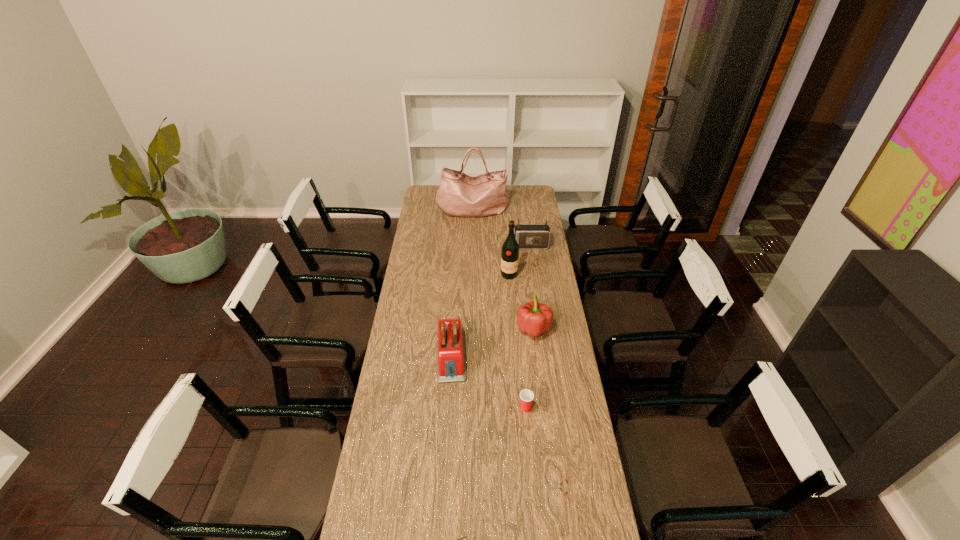
Locate an element on the screen. Image resolution: width=960 pixels, height=540 pixels. object that is at the far edge is located at coordinates (460, 195).

You are a GUI agent. You are given a task and a screenshot of the screen. Output one action in this format:
    pyautogui.click(x=<x>, y=<y>)
    Task: Click on the object located at the left edge
    This screenshot has height=540, width=960.
    Given the screenshot: What is the action you would take?
    pyautogui.click(x=460, y=195)

Identify the location of camcorder positioned at the right edge. The image size is (960, 540). (528, 236).

In order to click on bell pepper located at the right edge in this screenshot , I will do `click(534, 318)`.

Locate an element on the screen. The image size is (960, 540). shears present at the right edge is located at coordinates (557, 486).

The image size is (960, 540). I want to click on object that is at the far left corner, so click(x=460, y=195).

The image size is (960, 540). What are the coordinates of `free region at the left edge of the desktop` in the screenshot? It's located at (409, 275).

At what (x,y) coordinates should I click in order to perform the action: click on free spot at the right edge of the desktop. Please return your answer as a coordinate pair (x, y). This screenshot has width=960, height=540. Looking at the image, I should click on tap(581, 477).

The width and height of the screenshot is (960, 540). I want to click on unoccupied area between the third shortest object and the toaster, so click(489, 381).

Find the location of a particular element. unoccupied area between the farthest object and the shortest object is located at coordinates (517, 349).